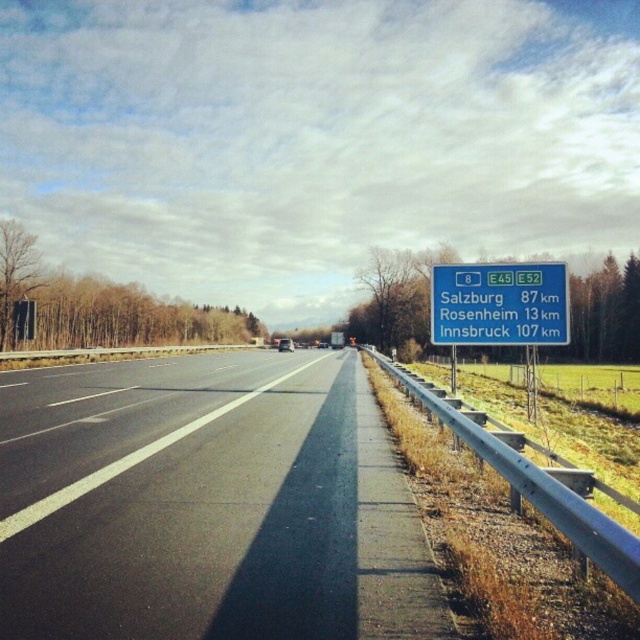
You are standing on the side of the highway near the guardrail. You notice a point marked at coordinates point (150, 560). If you want to reach this point as quickly as possible, should you walk directly towards it or follow the guardrail? Explain your answer based on the distance provided.

The point (150, 560) is 18.81 feet away from the viewer. Since the shortest path is a straight line, walking directly towards it would be faster than following the guardrail, which would add extra distance.

You are driving a car and need to determine if there is enough space to safely pass another vehicle on the black asphalt highway at center while avoiding the green plastic sign at right. Based on their sizes, can you estimate if the highway is wide enough?

The black asphalt highway at center is larger in size than the green plastic sign at right, so the highway is likely wide enough to safely pass another vehicle while avoiding the sign.

You are driving a car and see the black asphalt highway at center and the green plastic sign at right. Which object is closer to you?

The black asphalt highway at center is closer to you because it is in front of the green plastic sign at right.